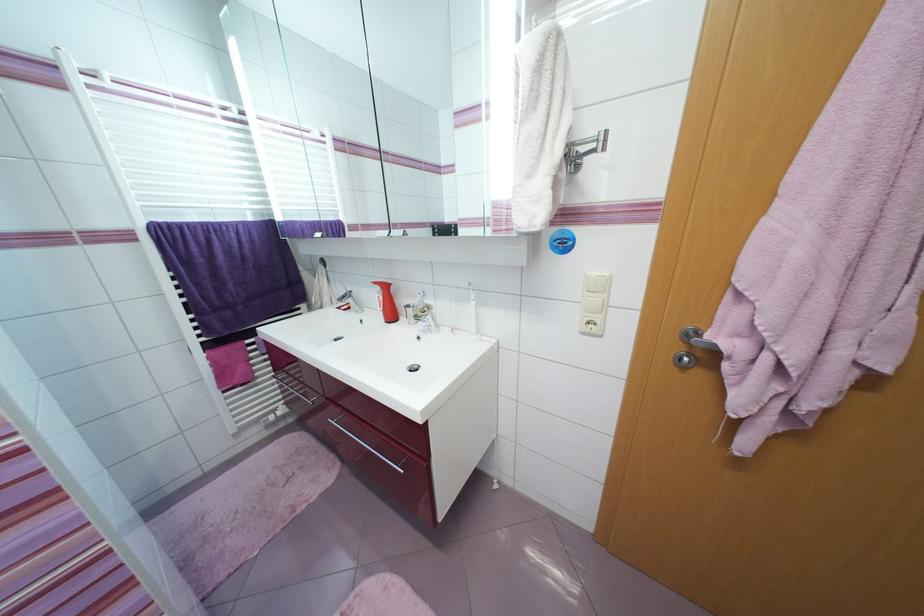
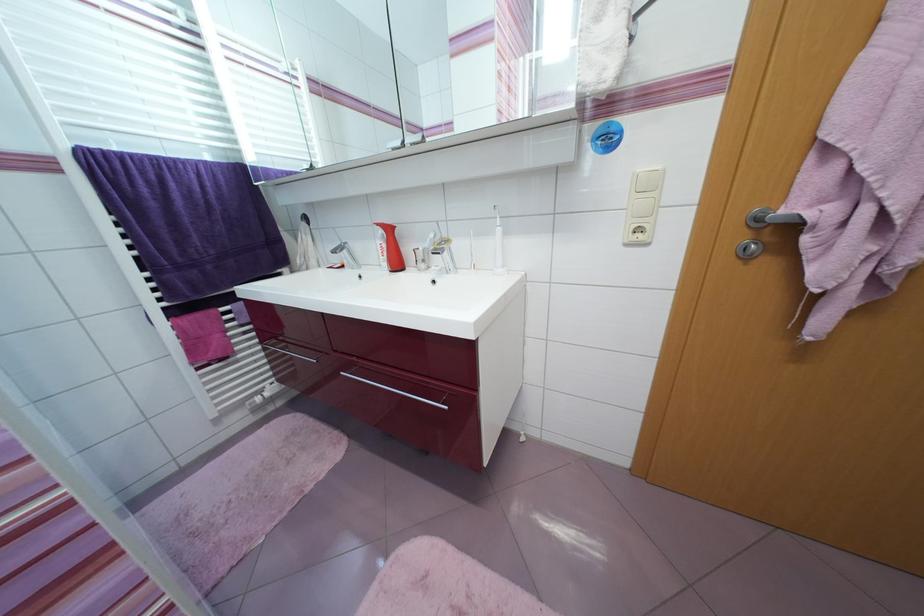
Locate, in the second image, the point that corresponds to (686,350) in the first image.

(748, 238)